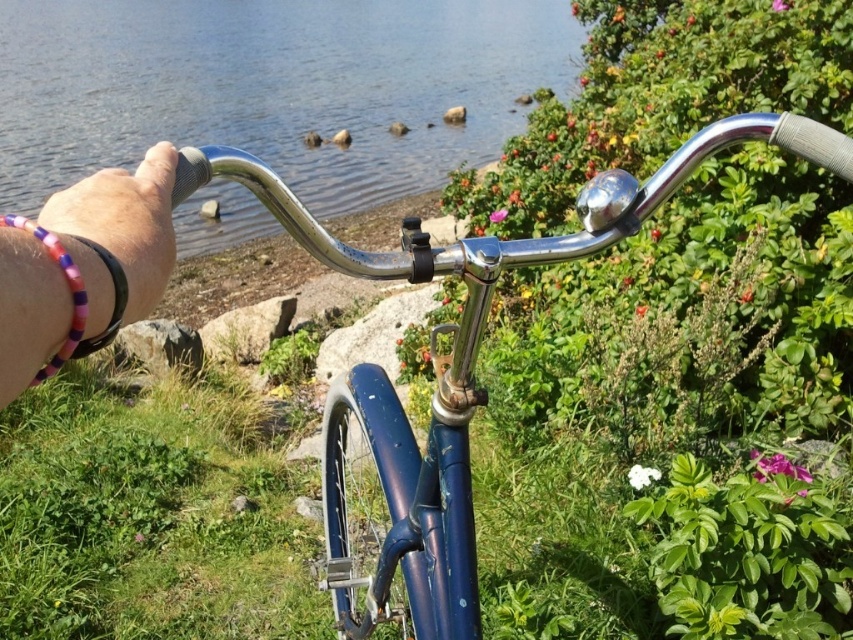
You are riding a bicycle and notice two purple beaded bracelets on the handlebars. Which bracelet is closer to your hand? The purple beaded bracelet at lower left or the purple beaded bracelet at left?

The purple beaded bracelet at lower left is positioned over the purple beaded bracelet at left, so the bracelet closer to your hand is the purple beaded bracelet at lower left.

You are riding a bicycle and want to throw a small pebble from the purple beaded bracelet at left into the clear blue water at upper center. If you can throw the pebble 12 meters, will it reach the water?

The clear blue water at upper center is 13.05 meters away from the purple beaded bracelet at left. Since the throwing distance is 12 meters, which is less than the required distance, the pebble will not reach the water.